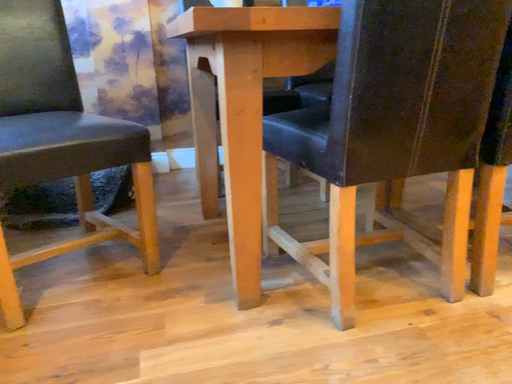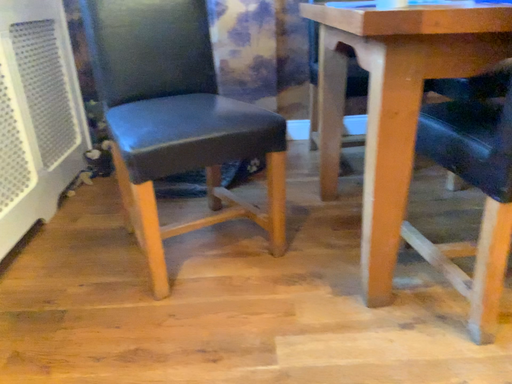
Question: How did the camera likely rotate when shooting the video?

Choices:
 (A) rotated right
 (B) rotated left

Answer: (B)